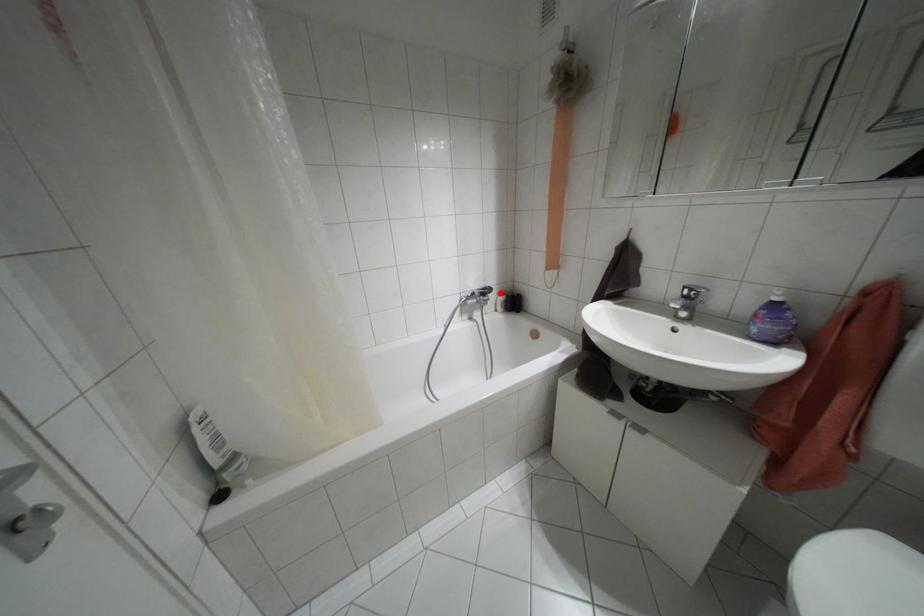
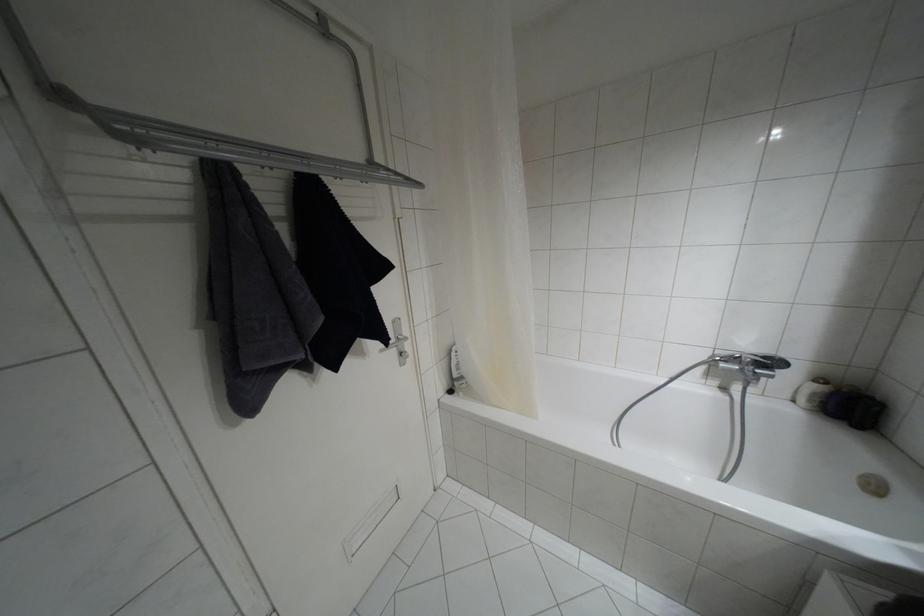
Find the pixel in the second image that matches the highlighted location in the first image.

(820, 379)